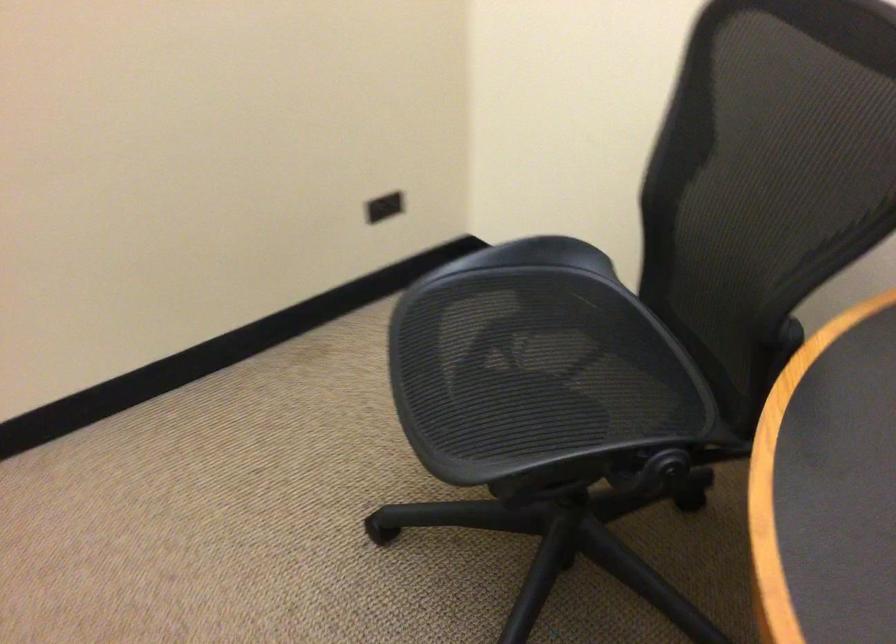
What do you see at coordinates (532, 373) in the screenshot?
I see `the chair sitting surface` at bounding box center [532, 373].